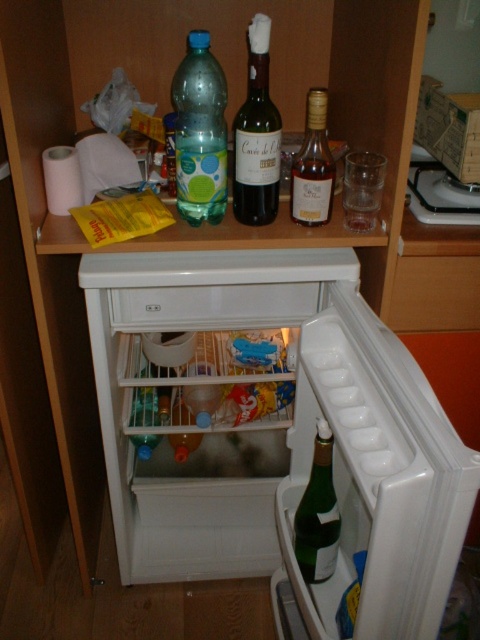
Which of these two, green glass bottle at lower center or wooden drawer at center, stands taller?

Standing taller between the two is green glass bottle at lower center.

This screenshot has width=480, height=640. Describe the element at coordinates (277, 435) in the screenshot. I see `green glass bottle at lower center` at that location.

This screenshot has width=480, height=640. What are the coordinates of `green glass bottle at lower center` in the screenshot? It's located at (277, 435).

Between green glass bottle at lower center and green glass bottle at lower right, which one has more height?

green glass bottle at lower center is taller.

Does green glass bottle at lower center appear over green glass bottle at lower right?

Correct, green glass bottle at lower center is located above green glass bottle at lower right.

Does point (181, 272) come closer to viewer compared to point (317, 445)?

That is False.

Image resolution: width=480 pixels, height=640 pixels. In order to click on green glass bottle at lower center in this screenshot , I will do `click(277, 435)`.

Describe the element at coordinates (200, 132) in the screenshot. Image resolution: width=480 pixels, height=640 pixels. I see `translucent plastic bottle at upper center` at that location.

Can you confirm if translucent plastic bottle at upper center is positioned below green glass bottle at center?

Result: No, translucent plastic bottle at upper center is not below green glass bottle at center.

Where is `translucent plastic bottle at upper center`? translucent plastic bottle at upper center is located at coordinates (200, 132).